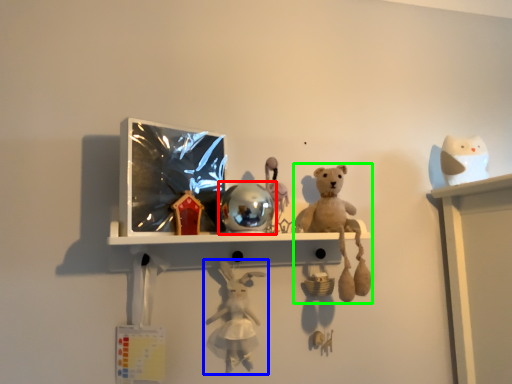
Question: Based on their relative distances, which object is farther from toy (highlighted by a red box)? Choose from toy (highlighted by a blue box) and toy (highlighted by a green box).

Choices:
 (A) toy
 (B) toy

Answer: (A)